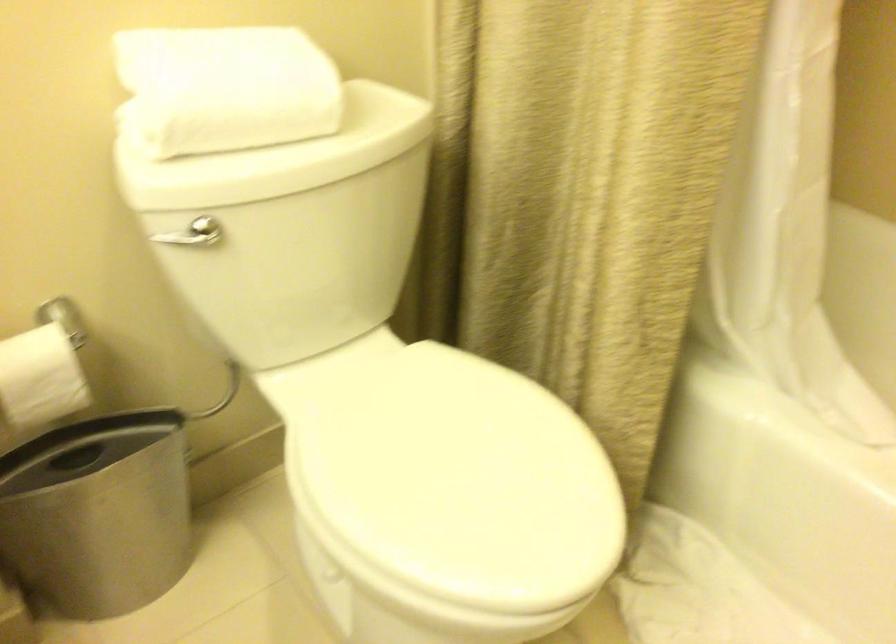
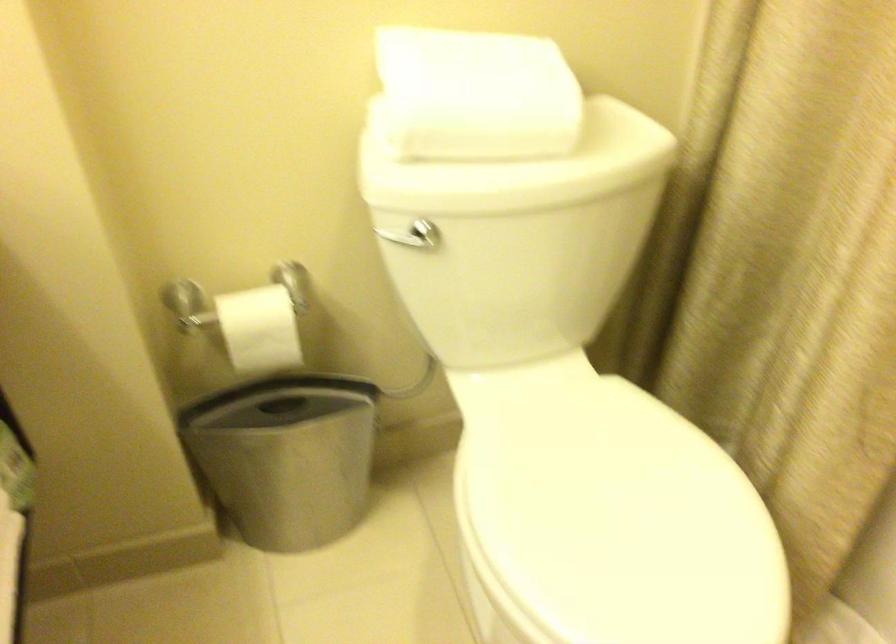
Where in the second image is the point corresponding to pixel 231 80 from the first image?

(476, 95)